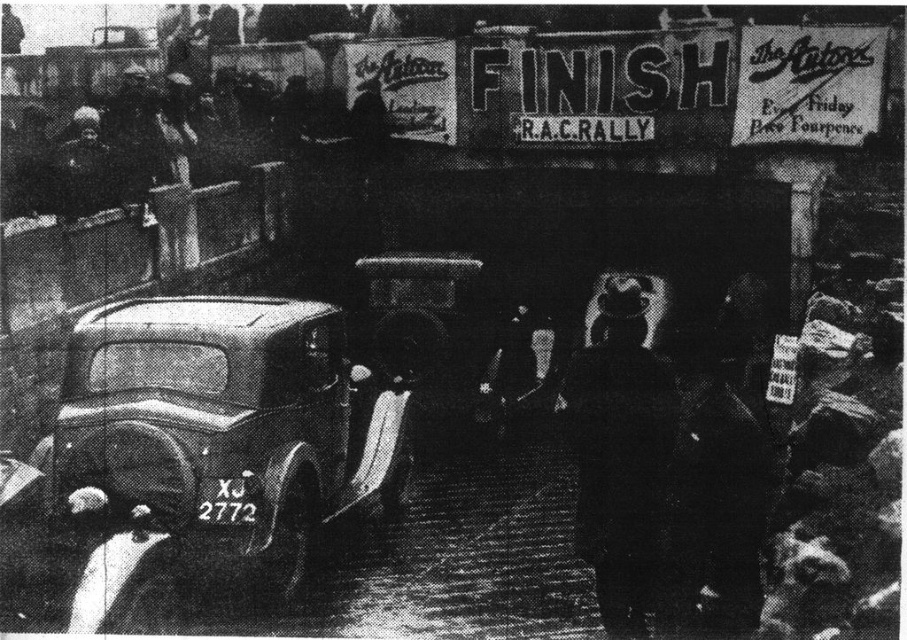
You are a photographer positioned at the finish line of the R.A.C. Rally. You want to take a photo of the metallic silver car at center and the dark wool coat at center. If your camera has a maximum focus range of 10 feet, will both subjects be in focus?

The metallic silver car at center is 9.34 feet away from the dark wool coat at center. Since the camera can focus up to 10 feet, both subjects are within the focus range and will be in focus.

You are a photographer at the finish line of the R.A.C. Rally. You want to take a photo of both the metallic silver car at center and the dark wool coat at center. Since you can only focus on one object at a time, which object should you focus on first to ensure it appears sharp in the photo?

The metallic silver car at center is closer to the viewer than the dark wool coat at center, so you should focus on the metallic silver car at center first to ensure it appears sharp. Adjusting focus for the dark wool coat at center afterward will require refocusing due to their different distances from the camera.

You are a photographer standing at the finish line of the R.A.C. Rally. You want to take a photo of the metallic silver car at center. If your camera can focus on objects within 5 meters, will you need to move closer to capture a clear shot?

The metallic silver car at center is 5.79 meters away from the camera. Since the camera can only focus within 5 meters, you need to move closer to ensure the metallic silver car at center is within the focus range.